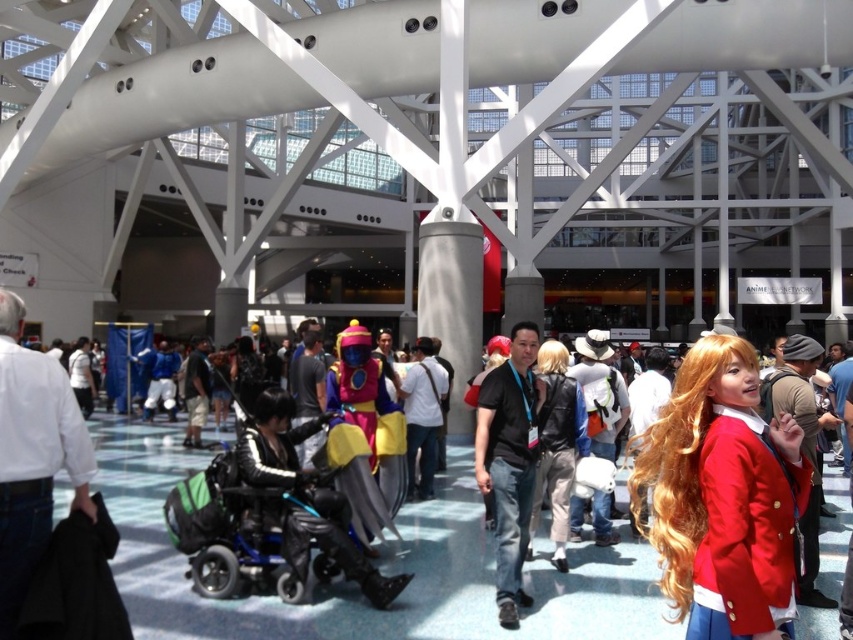
You are standing at the entrance of the convention center and want to locate the satin red blazer at center. According to the coordinates provided, in which direction should you look to find it?

The satin red blazer at center is located at point coordinates, so you should look towards the lower right direction from your current position at the entrance.

Based on the photo, you are an event organizer who needs to arrange two performers on stage. You have a satin red blazer at center and a shiny metallic costume at center. Based on their sizes, which performer should stand closer to the front to ensure visibility for the audience?

The satin red blazer at center is taller than the shiny metallic costume at center, so placing the satin red blazer at center closer to the front will ensure better visibility for the audience.

You are a photographer at the convention center. You need to position yourself so that you can capture both the black matte shirt at center and the shiny metallic costume at center in the same frame. Which direction should you move to ensure both are visible?

Since the black matte shirt at center is to the right of the shiny metallic costume at center, you should move to the left to ensure both are visible in the frame.